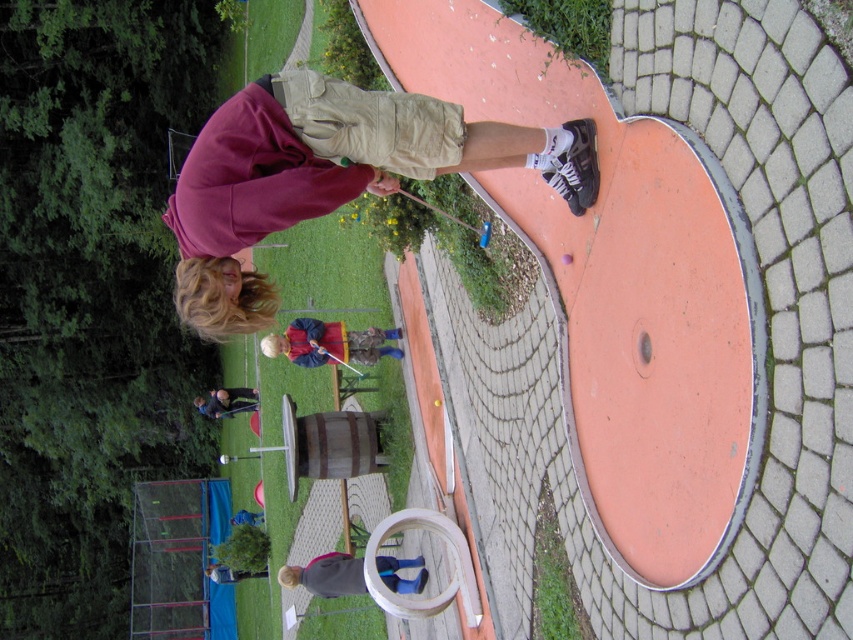
Is maroon fleece jacket at upper left further to camera compared to dark gray sweater at lower center?

No, maroon fleece jacket at upper left is in front of dark gray sweater at lower center.

Which is in front, point (399, 161) or point (310, 584)?

Point (399, 161) is more forward.

Is point (242, 88) farther from camera compared to point (331, 592)?

Yes, it is behind point (331, 592).

At what (x,y) coordinates should I click in order to perform the action: click on maroon fleece jacket at upper left. Please return your answer as a coordinate pair (x, y). The image size is (853, 640). Looking at the image, I should click on (329, 176).

Is maroon fleece jacket at upper left below matte blue shirt at center?

Actually, maroon fleece jacket at upper left is above matte blue shirt at center.

Between maroon fleece jacket at upper left and matte blue shirt at center, which one appears on the right side from the viewer's perspective?

From the viewer's perspective, maroon fleece jacket at upper left appears more on the right side.

What do you see at coordinates (329, 176) in the screenshot?
I see `maroon fleece jacket at upper left` at bounding box center [329, 176].

Find the location of a particular element. maroon fleece jacket at upper left is located at coordinates (329, 176).

Is matte blue shirt at center further to the viewer compared to dark gray sweater at lower center?

That is True.

Is point (364, 353) positioned in front of point (381, 570)?

No, it is not.

Between point (339, 324) and point (380, 577), which one is positioned in front?

Point (380, 577) is more forward.

This screenshot has height=640, width=853. I want to click on matte blue shirt at center, so click(x=329, y=342).